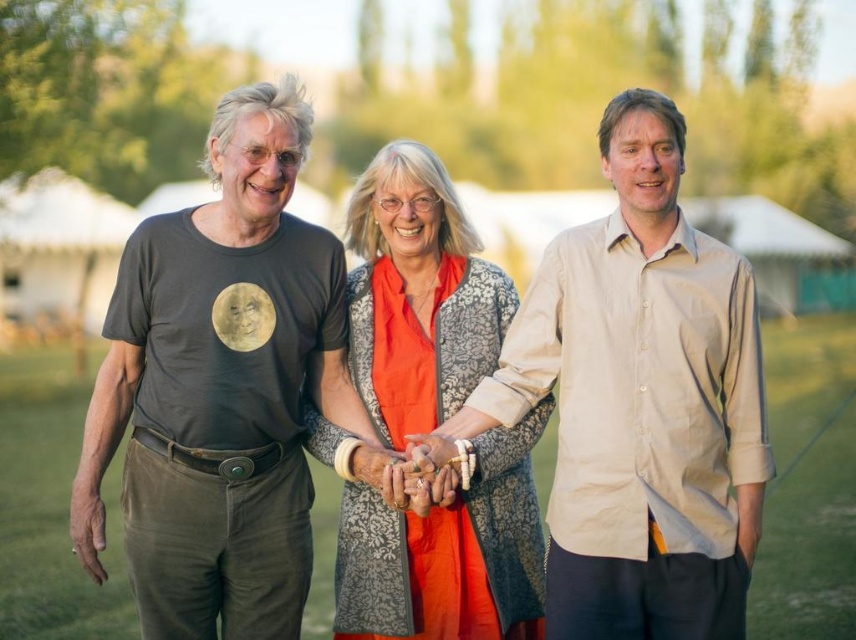
Based on the photo, is beige cotton shirt at center shorter than orange fabric dress at center?

Yes, beige cotton shirt at center is shorter than orange fabric dress at center.

Which of these two, beige cotton shirt at center or orange fabric dress at center, stands taller?

With more height is orange fabric dress at center.

Where is `beige cotton shirt at center`? This screenshot has width=856, height=640. beige cotton shirt at center is located at coordinates (640, 403).

Image resolution: width=856 pixels, height=640 pixels. I want to click on beige cotton shirt at center, so click(640, 403).

Which is more to the right, dark gray t-shirt at center or orange fabric dress at center?

orange fabric dress at center

Is point (215, 572) closer to camera compared to point (453, 538)?

That is False.

Locate an element on the screen. Image resolution: width=856 pixels, height=640 pixels. dark gray t-shirt at center is located at coordinates (220, 387).

Between dark gray t-shirt at center and beige cotton shirt at center, which one is positioned higher?

Positioned higher is beige cotton shirt at center.

From the picture: Is dark gray t-shirt at center smaller than beige cotton shirt at center?

Indeed, dark gray t-shirt at center has a smaller size compared to beige cotton shirt at center.

You are a GUI agent. You are given a task and a screenshot of the screen. Output one action in this format:
    pyautogui.click(x=<x>, y=<y>)
    Task: Click on the dark gray t-shirt at center
    
    Given the screenshot: What is the action you would take?
    pyautogui.click(x=220, y=387)